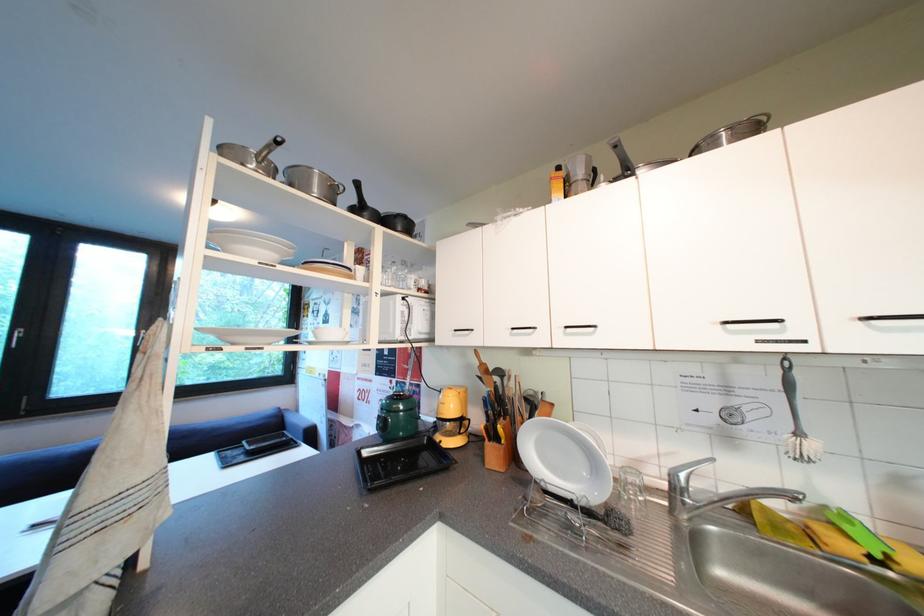
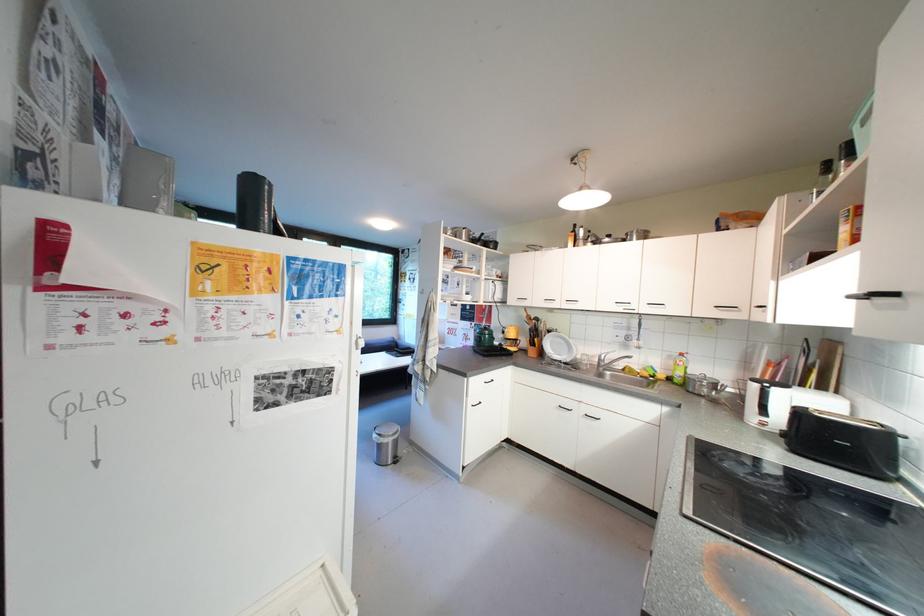
In the second image, find the point that corresponds to point 440,342 in the first image.

(512, 304)